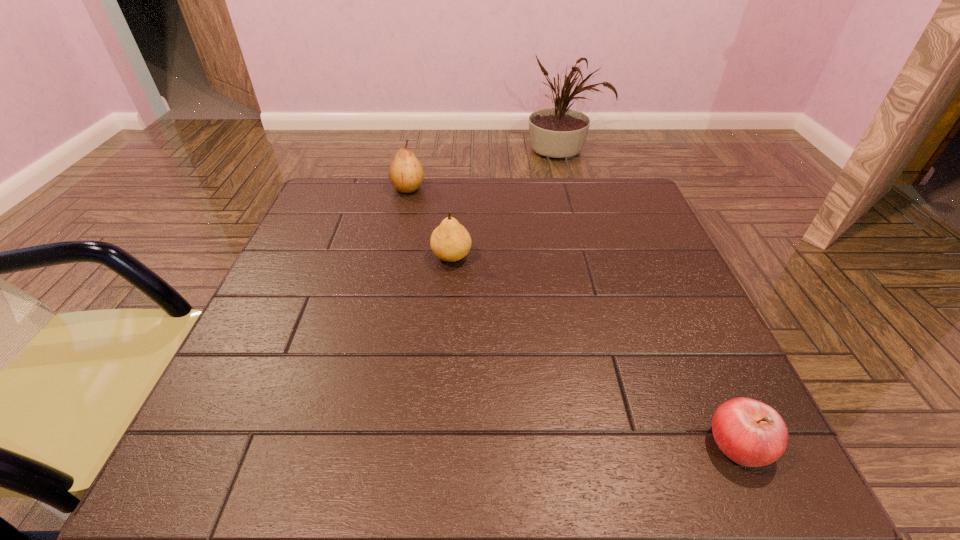
Identify which object is the second nearest to the nearest object. Please provide its 2D coordinates. Your answer should be formatted as a tuple, i.e. [(x, y)], where the tuple contains the x and y coordinates of a point satisfying the conditions above.

[(406, 174)]

Where is `vacant region that satisfies the following two spatial constraints: 1. on the front side of the rightmost object; 2. on the right side of the nearer pear`? This screenshot has height=540, width=960. vacant region that satisfies the following two spatial constraints: 1. on the front side of the rightmost object; 2. on the right side of the nearer pear is located at coordinates (438, 444).